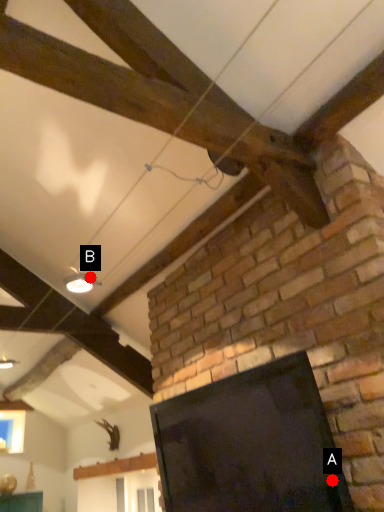
Question: Two points are circled on the image, labeled by A and B beside each circle. Which point is closer to the camera taking this photo?

Choices:
 (A) A is closer
 (B) B is closer

Answer: (A)